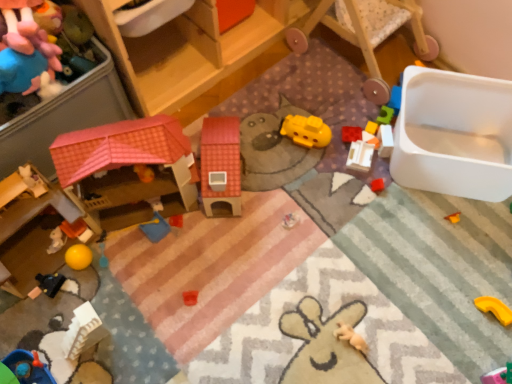
Image resolution: width=512 pixels, height=384 pixels. In order to click on vacant region in front of white plastic building at center-right, the eighth toy when ordered from left to right in this screenshot , I will do `click(368, 206)`.